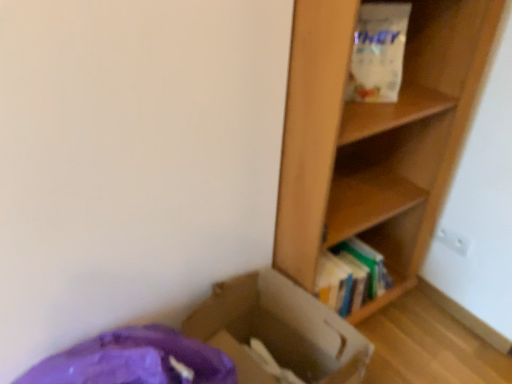
Question: From the image's perspective, is white matte paper bag at upper right above cardboard box at lower left?

Choices:
 (A) yes
 (B) no

Answer: (A)

Question: Is white matte paper bag at upper right surrounding cardboard box at lower left?

Choices:
 (A) no
 (B) yes

Answer: (A)

Question: Does white matte paper bag at upper right have a larger size compared to cardboard box at lower left?

Choices:
 (A) yes
 (B) no

Answer: (B)

Question: Does white matte paper bag at upper right have a lesser height compared to cardboard box at lower left?

Choices:
 (A) no
 (B) yes

Answer: (B)

Question: From a real-world perspective, does white matte paper bag at upper right sit lower than cardboard box at lower left?

Choices:
 (A) no
 (B) yes

Answer: (A)

Question: Is wooden shelf at right wider or thinner than wooden bookshelf at right?

Choices:
 (A) wide
 (B) thin

Answer: (A)

Question: From the image's perspective, is wooden shelf at right above or below wooden bookshelf at right?

Choices:
 (A) below
 (B) above

Answer: (B)

Question: Relative to wooden bookshelf at right, is wooden shelf at right in front or behind?

Choices:
 (A) front
 (B) behind

Answer: (A)

Question: Is wooden shelf at right situated inside wooden bookshelf at right or outside?

Choices:
 (A) inside
 (B) outside

Answer: (B)

Question: Considering the positions of point (412, 251) and point (320, 62), is point (412, 251) closer or farther from the camera than point (320, 62)?

Choices:
 (A) closer
 (B) farther

Answer: (B)

Question: Do you think wooden bookshelf at right is within wooden shelf at right, or outside of it?

Choices:
 (A) outside
 (B) inside

Answer: (B)

Question: Considering the positions of wooden bookshelf at right and wooden shelf at right in the image, is wooden bookshelf at right wider or thinner than wooden shelf at right?

Choices:
 (A) thin
 (B) wide

Answer: (A)

Question: From a real-world perspective, relative to wooden shelf at right, is wooden bookshelf at right vertically above or below?

Choices:
 (A) below
 (B) above

Answer: (A)

Question: Is point (380, 11) closer or farther from the camera than point (400, 203)?

Choices:
 (A) closer
 (B) farther

Answer: (A)

Question: Based on their positions, is white matte paper bag at upper right located to the left or right of wooden bookshelf at right?

Choices:
 (A) right
 (B) left

Answer: (A)